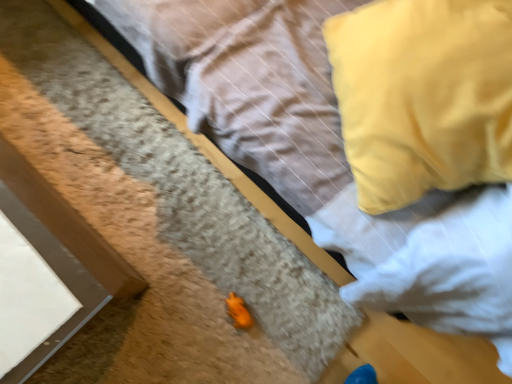
Question: Does orange matte toy frog at lower center come in front of yellow fabric pillow at upper right?

Choices:
 (A) no
 (B) yes

Answer: (A)

Question: Is orange matte toy frog at lower center to the right of yellow fabric pillow at upper right from the viewer's perspective?

Choices:
 (A) yes
 (B) no

Answer: (B)

Question: Is orange matte toy frog at lower center aimed at yellow fabric pillow at upper right?

Choices:
 (A) no
 (B) yes

Answer: (A)

Question: Is yellow fabric pillow at upper right completely or partially inside orange matte toy frog at lower center?

Choices:
 (A) yes
 (B) no

Answer: (B)

Question: Is orange matte toy frog at lower center shorter than yellow fabric pillow at upper right?

Choices:
 (A) no
 (B) yes

Answer: (B)

Question: Is orange matte toy frog at lower center to the left of yellow fabric pillow at upper right from the viewer's perspective?

Choices:
 (A) yes
 (B) no

Answer: (A)

Question: Is yellow fabric pillow at upper right in contact with orange matte toy frog at lower center?

Choices:
 (A) no
 (B) yes

Answer: (A)

Question: Is orange matte toy frog at lower center inside yellow fabric pillow at upper right?

Choices:
 (A) yes
 (B) no

Answer: (B)

Question: Is yellow fabric pillow at upper right aimed at orange matte toy frog at lower center?

Choices:
 (A) yes
 (B) no

Answer: (B)

Question: Does yellow fabric pillow at upper right have a lesser height compared to orange matte toy frog at lower center?

Choices:
 (A) no
 (B) yes

Answer: (A)

Question: Does yellow fabric pillow at upper right have a larger size compared to orange matte toy frog at lower center?

Choices:
 (A) no
 (B) yes

Answer: (B)

Question: Considering the relative positions of yellow fabric pillow at upper right and orange matte toy frog at lower center in the image provided, is yellow fabric pillow at upper right to the left of orange matte toy frog at lower center from the viewer's perspective?

Choices:
 (A) yes
 (B) no

Answer: (B)

Question: From the image's perspective, is yellow fabric pillow at upper right above or below orange matte toy frog at lower center?

Choices:
 (A) below
 (B) above

Answer: (B)